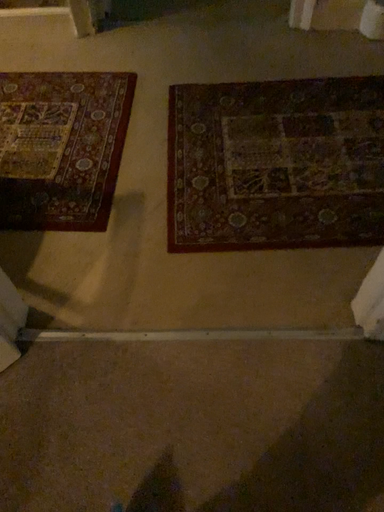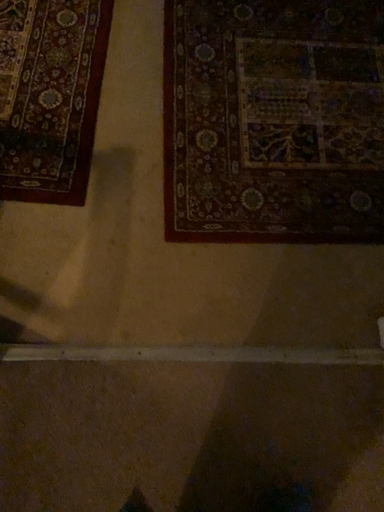
Question: Which way did the camera rotate in the video?

Choices:
 (A) rotated upward
 (B) rotated downward

Answer: (B)